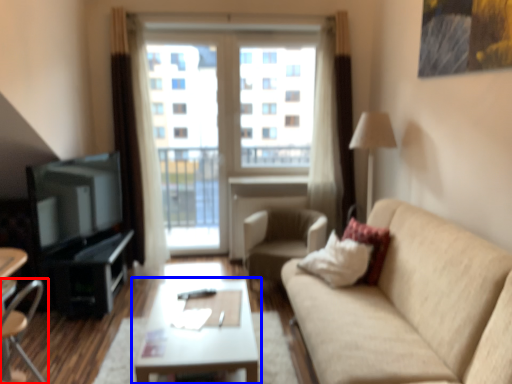
Question: Which object is further to the camera taking this photo, chair (highlighted by a red box) or coffee table (highlighted by a blue box)?

Choices:
 (A) chair
 (B) coffee table

Answer: (B)